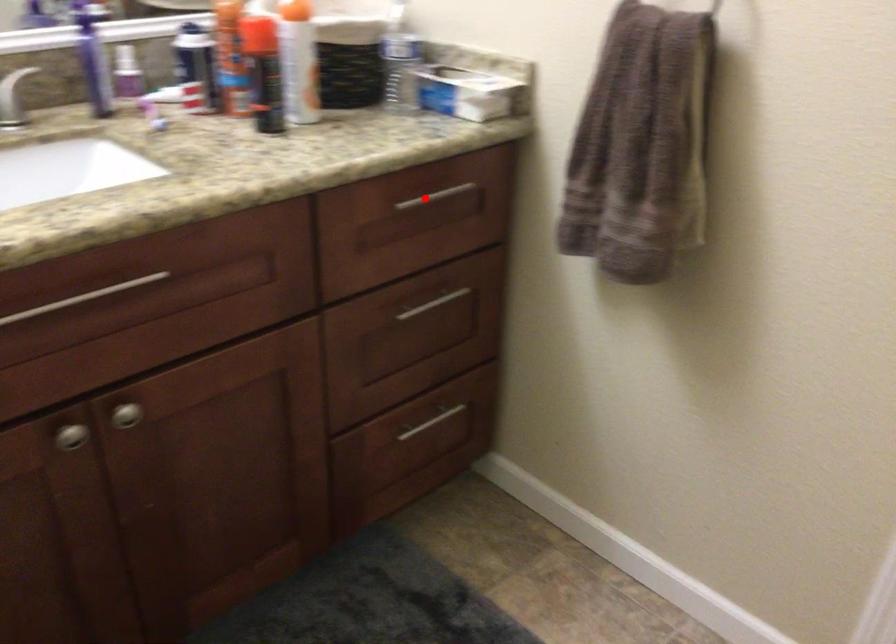
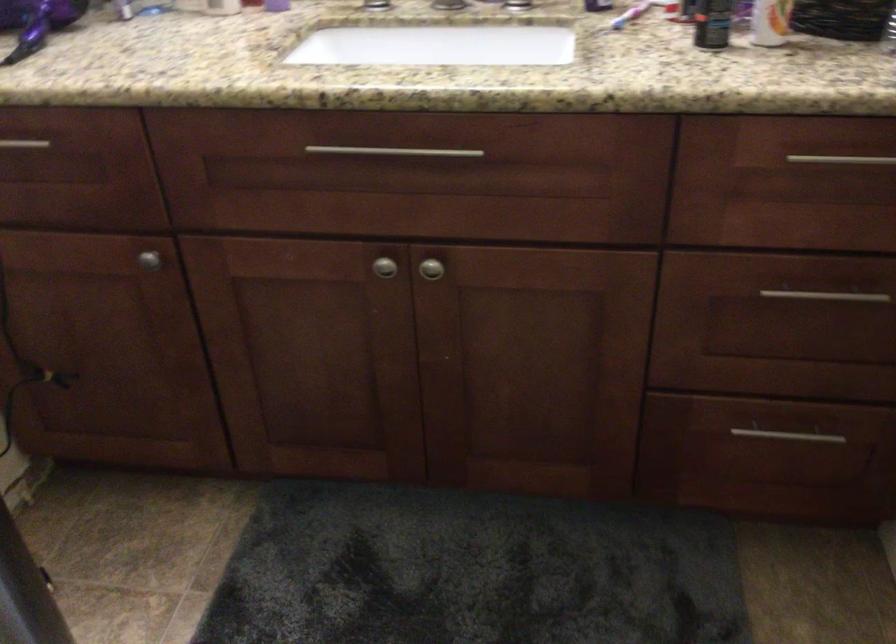
Find the pixel in the second image that matches the highlighted location in the first image.

(841, 158)